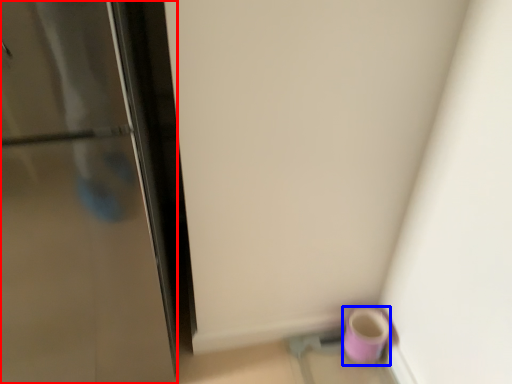
Question: Which of the following is the closest to the observer, door (highlighted by a red box) or mug (highlighted by a blue box)?

Choices:
 (A) door
 (B) mug

Answer: (A)